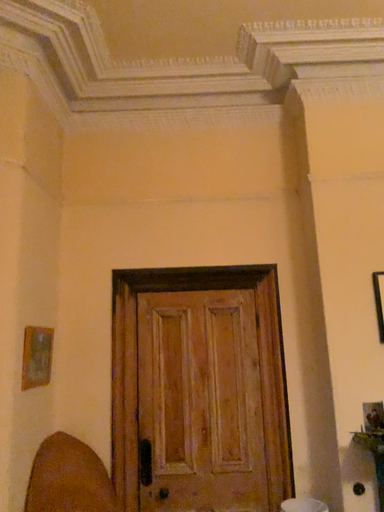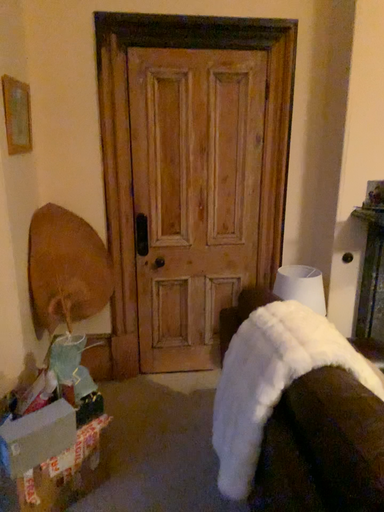
Question: Which way did the camera rotate in the video?

Choices:
 (A) rotated right
 (B) rotated left

Answer: (A)